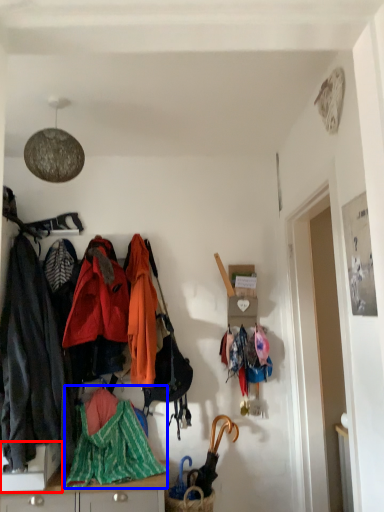
Question: Which object appears farthest to the camera in this image, desk (highlighted by a red box) or blanket (highlighted by a blue box)?

Choices:
 (A) desk
 (B) blanket

Answer: (B)